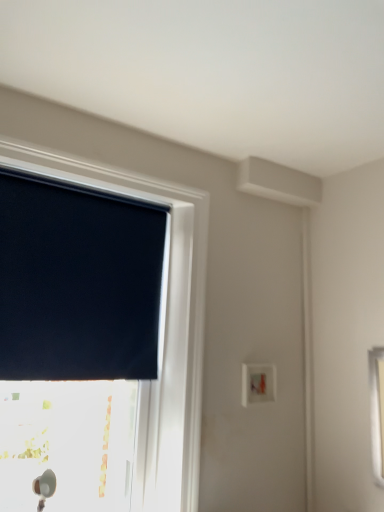
The image size is (384, 512). What do you see at coordinates (78, 282) in the screenshot?
I see `dark blue fabric at upper left` at bounding box center [78, 282].

Locate an element on the screen. dark blue fabric at upper left is located at coordinates (78, 282).

Can you confirm if white plastic light switch at center-right is taller than black matte window at upper left?

No.

Is white plastic light switch at center-right next to black matte window at upper left?

No.

In the scene shown: Is white plastic light switch at center-right facing towards black matte window at upper left?

No, white plastic light switch at center-right is not facing towards black matte window at upper left.

Locate an element on the screen. The height and width of the screenshot is (512, 384). light switch that is behind the dark blue fabric at upper left is located at coordinates (258, 383).

Is white plastic light switch at center-right smaller than dark blue fabric at upper left?

Indeed, white plastic light switch at center-right has a smaller size compared to dark blue fabric at upper left.

Is white plastic light switch at center-right aimed at dark blue fabric at upper left?

No, white plastic light switch at center-right is not facing towards dark blue fabric at upper left.

From a real-world perspective, who is located higher, white plastic light switch at center-right or dark blue fabric at upper left?

In real-world perspective, dark blue fabric at upper left is above.

Does black matte window at upper left have a larger size compared to dark blue fabric at upper left?

Indeed, black matte window at upper left has a larger size compared to dark blue fabric at upper left.

Between point (138, 187) and point (128, 371), which one is positioned behind?

The point (138, 187) is farther.

Is black matte window at upper left surrounding dark blue fabric at upper left?

Yes, dark blue fabric at upper left is inside black matte window at upper left.

Does black matte window at upper left turn towards dark blue fabric at upper left?

Yes, black matte window at upper left faces towards dark blue fabric at upper left.

I want to click on window blind that is above the black matte window at upper left (from a real-world perspective), so click(x=78, y=282).

From the image's perspective, which one is positioned higher, dark blue fabric at upper left or black matte window at upper left?

From the image's view, dark blue fabric at upper left is above.

Which object is more forward, dark blue fabric at upper left or black matte window at upper left?

Positioned in front is black matte window at upper left.

Would you say dark blue fabric at upper left is to the left or to the right of white plastic light switch at center-right in the picture?

dark blue fabric at upper left is to the left of white plastic light switch at center-right.

Based on the photo, would you say dark blue fabric at upper left contains white plastic light switch at center-right?

Actually, white plastic light switch at center-right is outside dark blue fabric at upper left.

Considering the points (118, 241) and (270, 398), which point is behind, point (118, 241) or point (270, 398)?

The point (270, 398) is farther from the camera.

In terms of width, does dark blue fabric at upper left look wider or thinner when compared to white plastic light switch at center-right?

Clearly, dark blue fabric at upper left has less width compared to white plastic light switch at center-right.

Between black matte window at upper left and white plastic light switch at center-right, which one has more height?

Standing taller between the two is black matte window at upper left.

From the picture: Between black matte window at upper left and white plastic light switch at center-right, which one appears on the left side from the viewer's perspective?

black matte window at upper left.

Is black matte window at upper left positioned far away from white plastic light switch at center-right?

black matte window at upper left is actually quite close to white plastic light switch at center-right.

Where is `light switch below the black matte window at upper left (from the image's perspective)`? The height and width of the screenshot is (512, 384). light switch below the black matte window at upper left (from the image's perspective) is located at coordinates (258, 383).

You are a GUI agent. You are given a task and a screenshot of the screen. Output one action in this format:
    pyautogui.click(x=<x>, y=<y>)
    Task: Click on the light switch that appears behind the dark blue fabric at upper left
    
    Given the screenshot: What is the action you would take?
    pyautogui.click(x=258, y=383)

Based on their spatial positions, is white plastic light switch at center-right or black matte window at upper left closer to dark blue fabric at upper left?

black matte window at upper left is positioned closer to the anchor dark blue fabric at upper left.

From the image, which object appears to be nearer to dark blue fabric at upper left, black matte window at upper left or white plastic light switch at center-right?

The object closer to dark blue fabric at upper left is black matte window at upper left.

From the image, which object appears to be farther from white plastic light switch at center-right, dark blue fabric at upper left or black matte window at upper left?

dark blue fabric at upper left is further to white plastic light switch at center-right.

Consider the image. Based on their spatial positions, is black matte window at upper left or dark blue fabric at upper left closer to white plastic light switch at center-right?

black matte window at upper left is closer to white plastic light switch at center-right.

Which object lies further to the anchor point black matte window at upper left, dark blue fabric at upper left or white plastic light switch at center-right?

white plastic light switch at center-right is positioned further to the anchor black matte window at upper left.

From the image, which object appears to be farther from black matte window at upper left, white plastic light switch at center-right or dark blue fabric at upper left?

white plastic light switch at center-right is further to black matte window at upper left.

Identify the location of window situated between dark blue fabric at upper left and white plastic light switch at center-right from left to right. (165, 326).